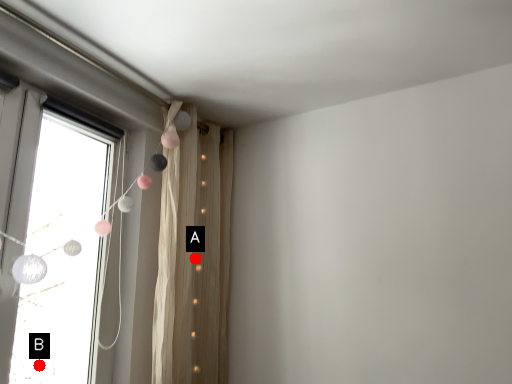
Question: Two points are circled on the image, labeled by A and B beside each circle. Among these points, which one is nearest to the camera?

Choices:
 (A) A is closer
 (B) B is closer

Answer: (A)